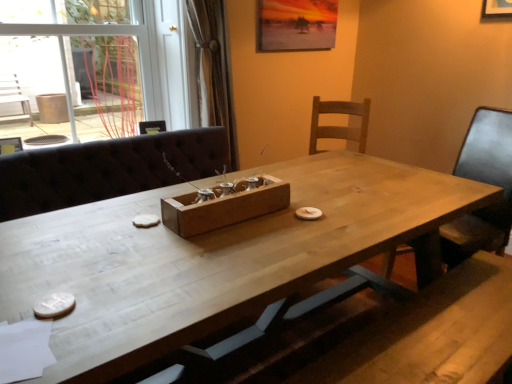
Where is `free space to the left of wooden tray at center`? Image resolution: width=512 pixels, height=384 pixels. free space to the left of wooden tray at center is located at coordinates (124, 225).